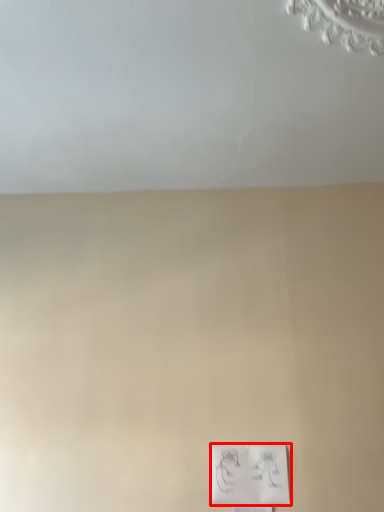
Question: From the image, what is the correct spatial relationship of light switch (annotated by the red box) in relation to backdrop?

Choices:
 (A) right
 (B) left

Answer: (A)